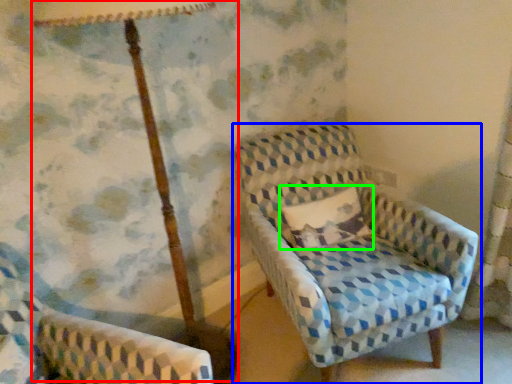
Question: Based on their relative distances, which object is farther from table lamp (highlighted by a red box)? Choose from chair (highlighted by a blue box) and pillow (highlighted by a green box).

Choices:
 (A) chair
 (B) pillow

Answer: (A)